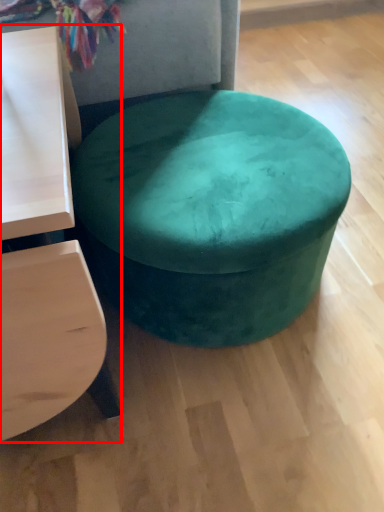
Question: Where is table (annotated by the red box) located in relation to stool in the image?

Choices:
 (A) left
 (B) right

Answer: (A)